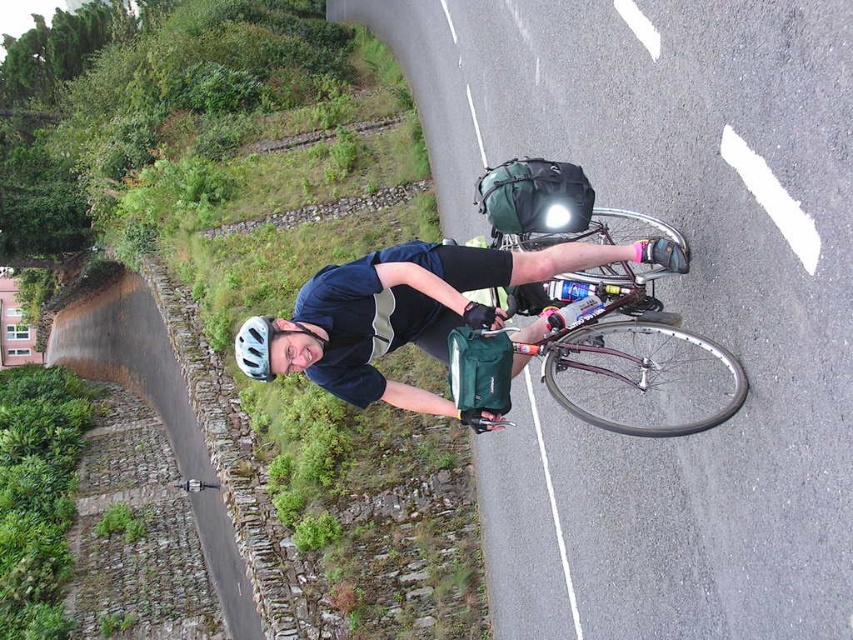
Question: Is matte black helmet at upper center positioned before white matte bicycle helmet at upper center?

Choices:
 (A) no
 (B) yes

Answer: (B)

Question: Which of the following is the farthest from the observer?

Choices:
 (A) (389, 285)
 (B) (595, 371)
 (C) (253, 378)

Answer: (A)

Question: Can you confirm if shiny metallic bicycle at right is smaller than white matte bicycle helmet at upper center?

Choices:
 (A) no
 (B) yes

Answer: (A)

Question: Considering the real-world distances, which object is farthest from the matte black helmet at upper center?

Choices:
 (A) white matte bicycle helmet at upper center
 (B) shiny metallic bicycle at right

Answer: (A)

Question: Is shiny metallic bicycle at right to the right of white matte bicycle helmet at upper center from the viewer's perspective?

Choices:
 (A) no
 (B) yes

Answer: (B)

Question: Which point appears closest to the camera in this image?

Choices:
 (A) (367, 285)
 (B) (512, 294)

Answer: (A)